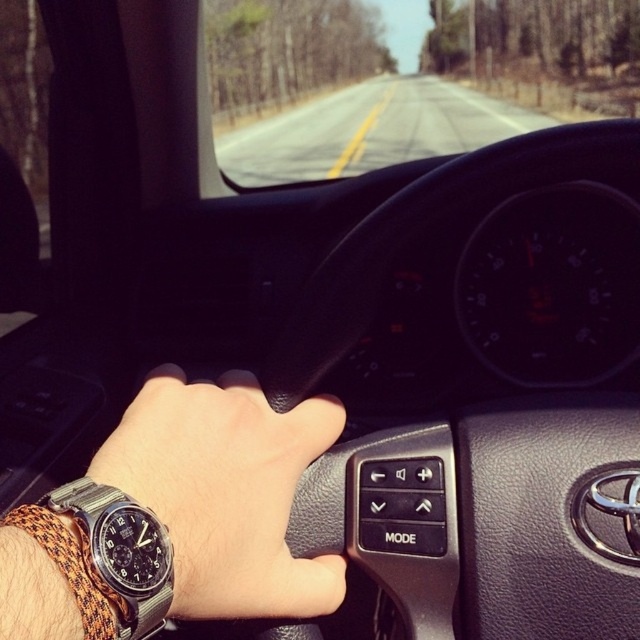
Question: Can you confirm if black leather steering wheel at center is bigger than silver metallic watch at lower left?

Choices:
 (A) yes
 (B) no

Answer: (A)

Question: Among these points, which one is nearest to the camera?

Choices:
 (A) (81, 516)
 (B) (362, 310)
 (C) (236, 515)

Answer: (A)

Question: Which of the following is the farthest from the observer?

Choices:
 (A) black leather steering wheel at center
 (B) silver metallic watch at lower left

Answer: (A)

Question: Is leather watch at center positioned before black leather steering wheel at center?

Choices:
 (A) no
 (B) yes

Answer: (B)

Question: Observing the image, what is the correct spatial positioning of leather watch at center in reference to black leather steering wheel at center?

Choices:
 (A) left
 (B) right

Answer: (A)

Question: Which object is closer to the camera taking this photo?

Choices:
 (A) silver metallic watch at lower left
 (B) leather watch at center
 (C) black leather steering wheel at center

Answer: (A)